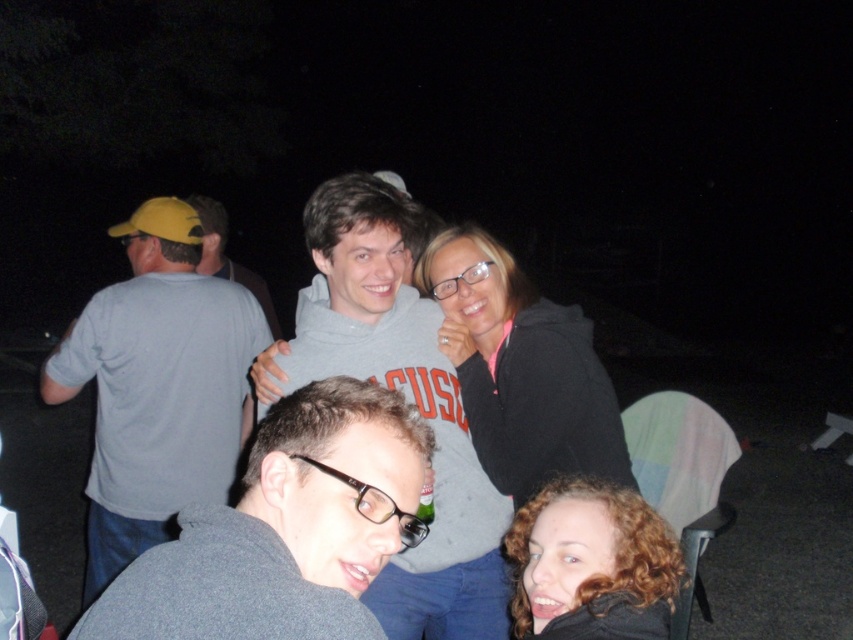
Looking at this image, you are a photographer trying to capture the perfect shot of the gray matte sweater at lower center. Based on the scene description, where should you position your camera to ensure the sweater is in focus?

To focus on the gray matte sweater at lower center located at point (x=285, y=529), position the camera so that the center of the frame aligns with those coordinates.